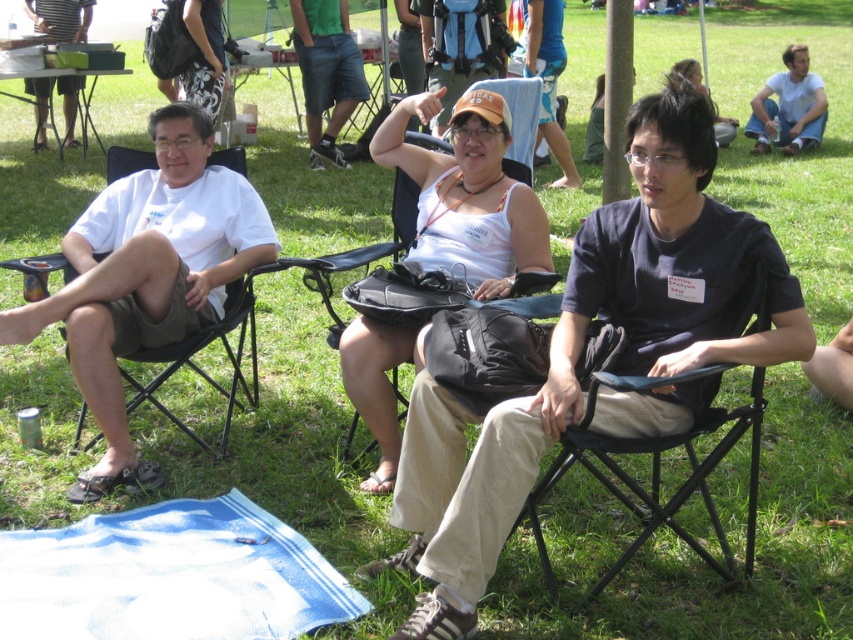
Consider the image. You are standing at the point marked by the coordinates point (x=93, y=362) and want to throw a frisbee to a friend who is standing 4 meters away from you. Can you reach your friend with one throw?

The distance between you and your friend is 4 meters, and the maximum distance you can throw is 3.36 meters. Therefore, you cannot reach your friend with one throw.